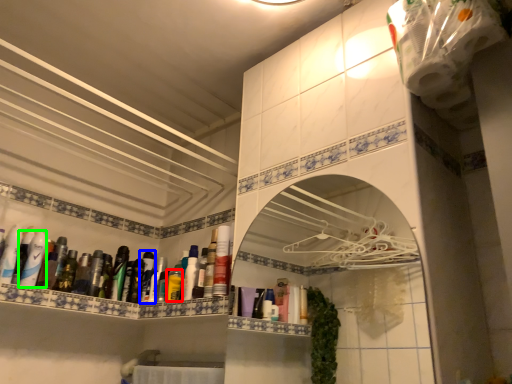
Question: Estimate the real-world distances between objects in this image. Which object is farther from mouthwash (highlighted by a red box), mouthwash (highlighted by a blue box) or mouthwash (highlighted by a green box)?

Choices:
 (A) mouthwash
 (B) mouthwash

Answer: (B)